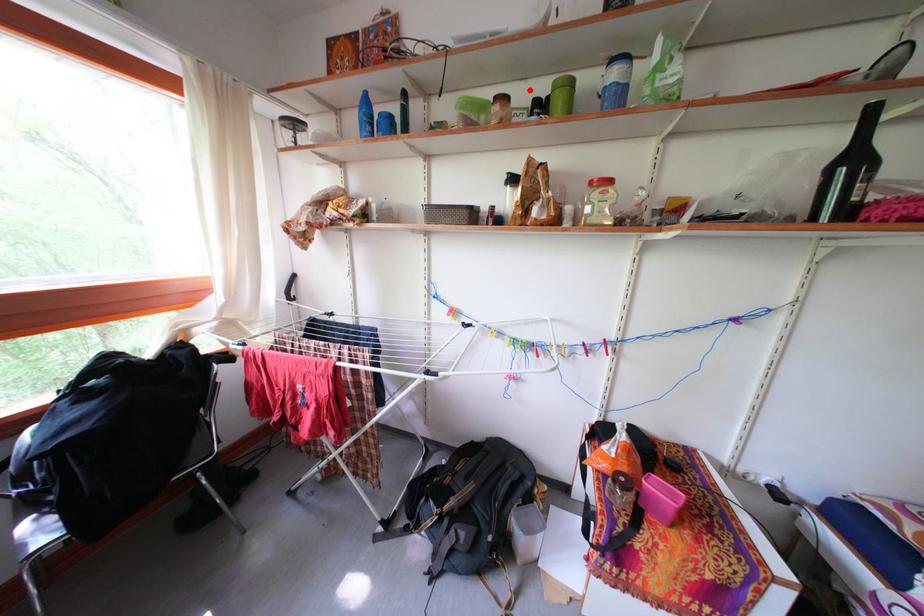
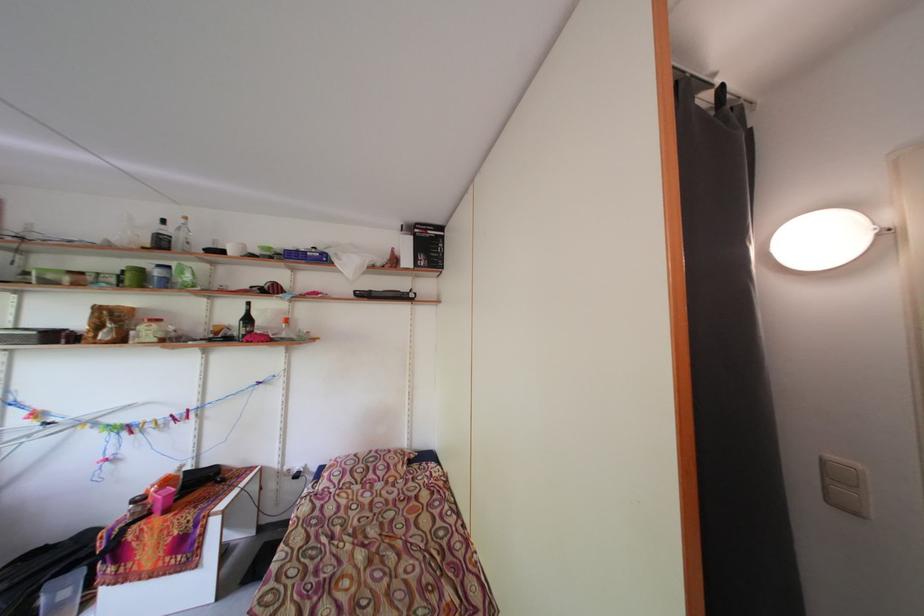
In the second image, find the point that corresponds to the highlighted location in the first image.

(127, 265)